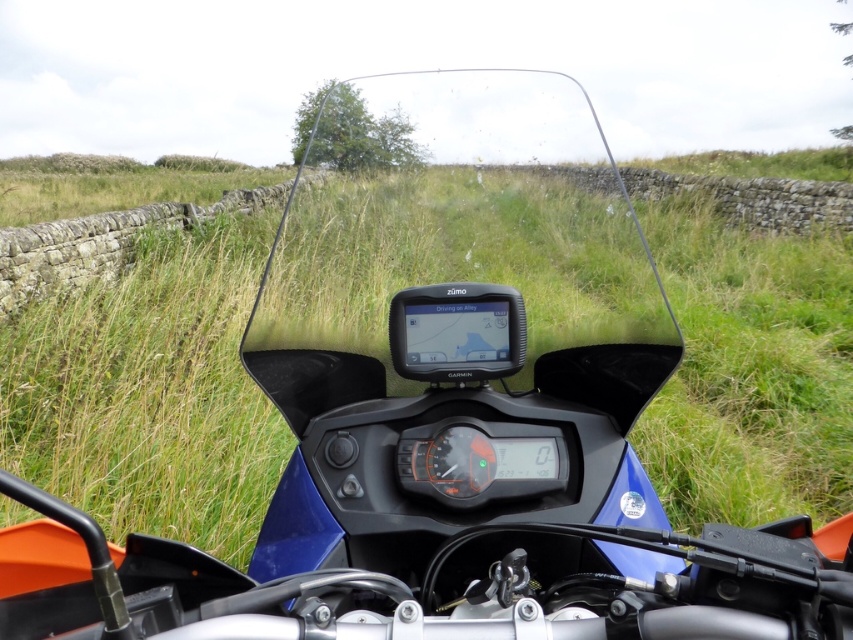
Question: Based on their relative distances, which object is nearer to the green grassy at center?

Choices:
 (A) matte black gps at center
 (B) transparent plastic windshield at center

Answer: (A)

Question: Which is nearer to the transparent plastic windshield at center?

Choices:
 (A) matte black gps at center
 (B) green grassy at center

Answer: (A)

Question: Which point is farther to the camera?

Choices:
 (A) (415, 324)
 (B) (328, 138)
 (C) (202, 464)

Answer: (C)

Question: Is transparent plastic windshield at center wider than matte black gps at center?

Choices:
 (A) yes
 (B) no

Answer: (B)

Question: Does green grassy at center have a greater width compared to matte black gps at center?

Choices:
 (A) yes
 (B) no

Answer: (A)

Question: Is green grassy at center above transparent plastic windshield at center?

Choices:
 (A) no
 (B) yes

Answer: (B)